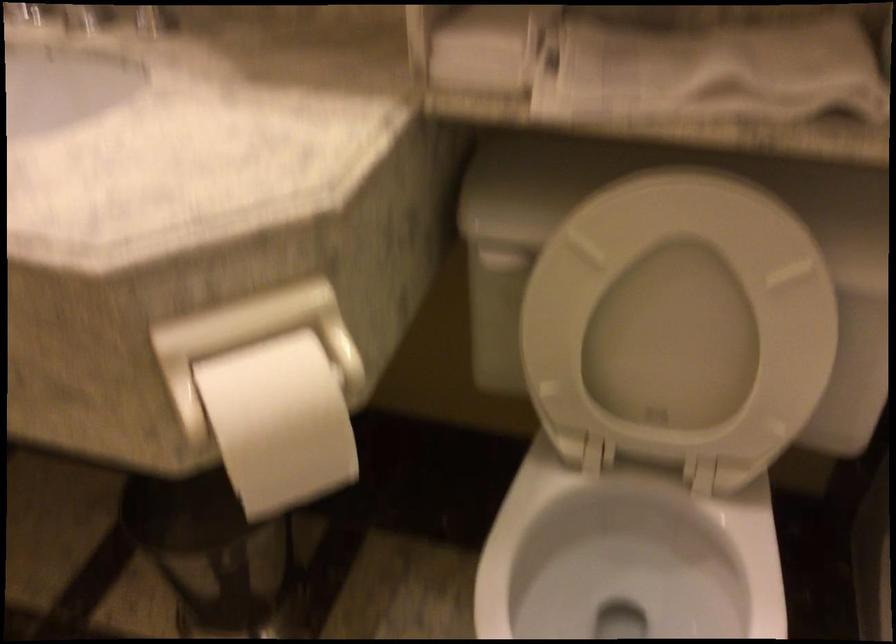
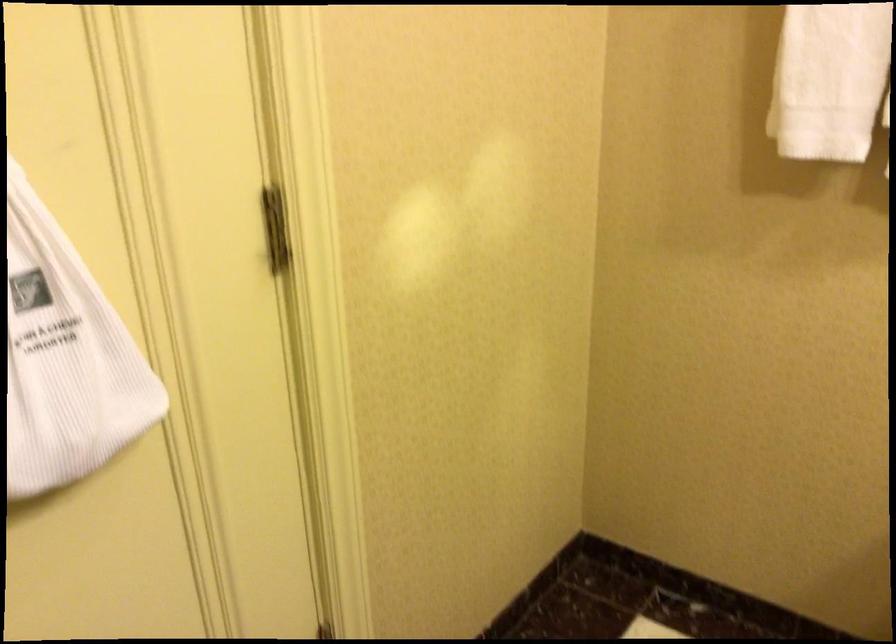
Based on the continuous images, in which direction is the camera rotating?

The camera rotated toward left-down.